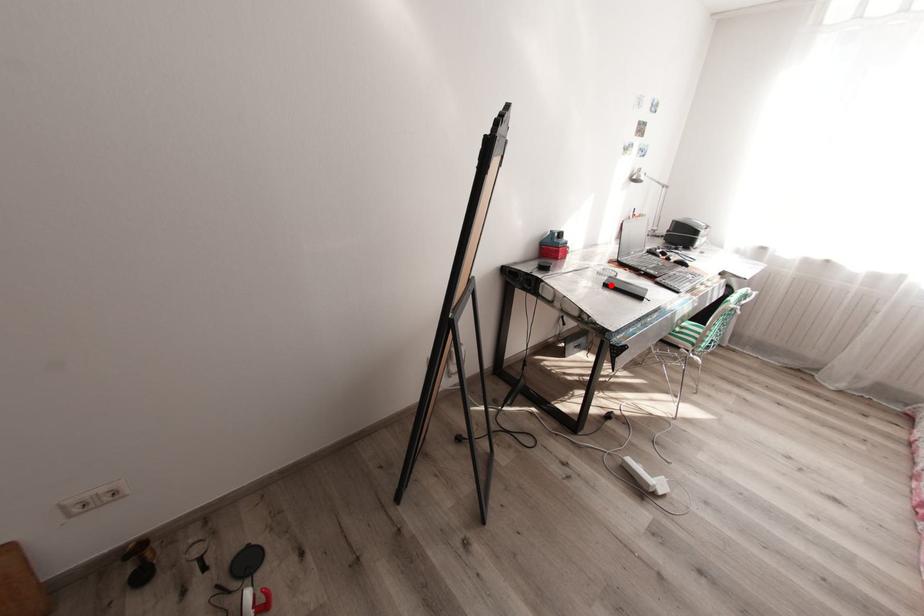
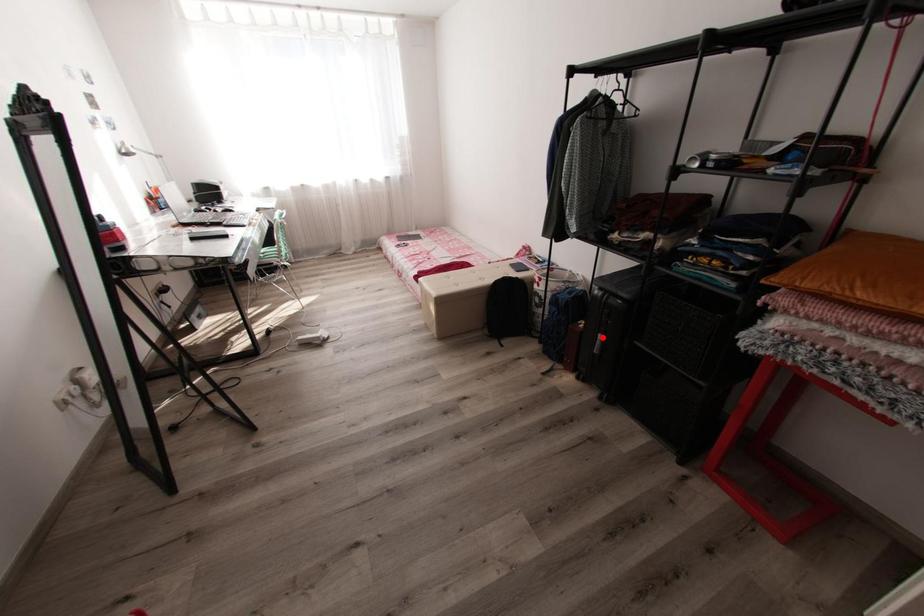
I am providing you with two images of the same scene from different viewpoints. A red point is marked on the first image and another point is marked on the second image. Does the point marked in image1 correspond to the same location as the one in image2?

No